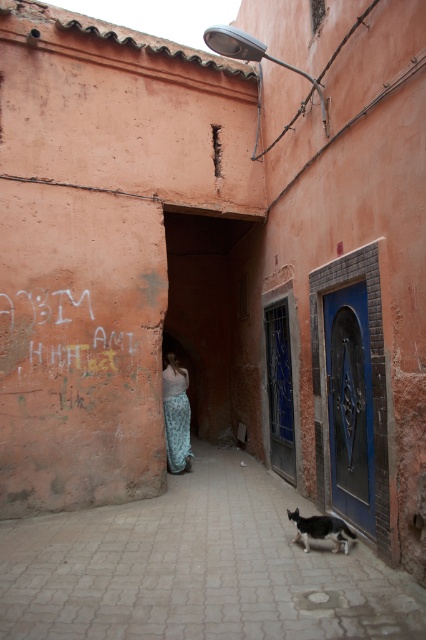
You are standing in the alleyway and see a black and white cat walking towards the blue door with intricate metalwork. There is a point marked at coordinates (176, 416). What object is this point located on?

The point at (176, 416) is located on the patterned fabric dress at center.

You are standing in the alleyway and want to take a photo of the black and white fur cat at lower right. Since the smooth stone alley at center is closer to you, will you be able to see the cat clearly in the background?

Yes, the smooth stone alley at center is closer to the viewer than the black and white fur cat at lower right, so the cat will be visible in the background but slightly less focused due to the distance.

You are standing in the alleyway and see the smooth stone alley at center and the patterned fabric dress at center. Which object is located to the right of the other?

The smooth stone alley at center is to the right of the patterned fabric dress at center according to the description.